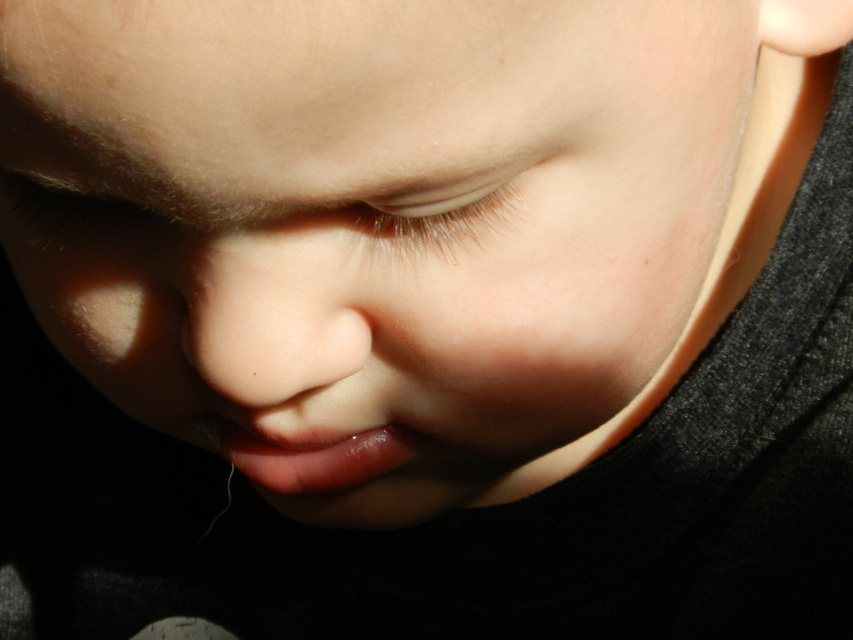
Does smooth skin face at center have a lesser width compared to translucent skin at center?

No, smooth skin face at center is not thinner than translucent skin at center.

Does smooth skin face at center come behind translucent skin at center?

That is False.

Does point (225, 92) come behind point (438, 236)?

No.

You are a GUI agent. You are given a task and a screenshot of the screen. Output one action in this format:
    pyautogui.click(x=<x>, y=<y>)
    Task: Click on the smooth skin face at center
    
    Given the screenshot: What is the action you would take?
    pyautogui.click(x=370, y=218)

Based on the photo, who is higher up, translucent skin at center or glossy pink lips at center?

Positioned higher is translucent skin at center.

Can you confirm if translucent skin at center is positioned to the right of glossy pink lips at center?

Indeed, translucent skin at center is positioned on the right side of glossy pink lips at center.

The image size is (853, 640). Describe the element at coordinates (442, 205) in the screenshot. I see `translucent skin at center` at that location.

Find the location of a particular element. This screenshot has width=853, height=640. translucent skin at center is located at coordinates (442, 205).

Does smooth skin face at center have a greater width compared to glossy pink lips at center?

Yes, smooth skin face at center is wider than glossy pink lips at center.

Where is `smooth skin face at center`? This screenshot has width=853, height=640. smooth skin face at center is located at coordinates pos(370,218).